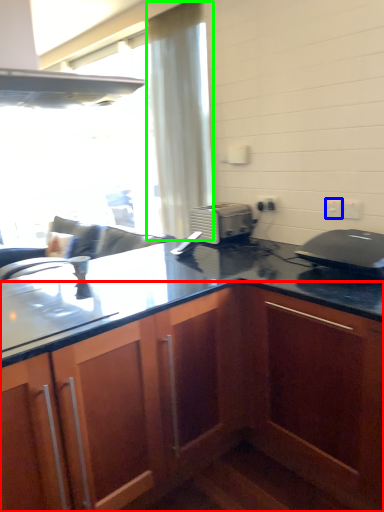
Question: Based on their relative distances, which object is nearer to cabinetry (highlighted by a red box)? Choose from electric outlet (highlighted by a blue box) and curtain (highlighted by a green box).

Choices:
 (A) electric outlet
 (B) curtain

Answer: (A)